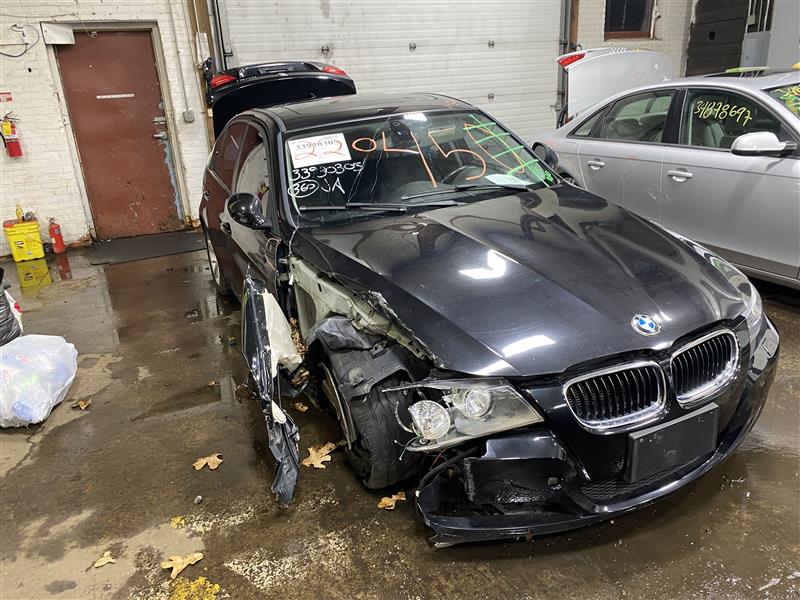
This screenshot has height=600, width=800. Identify the location of trash bag. (32, 383).